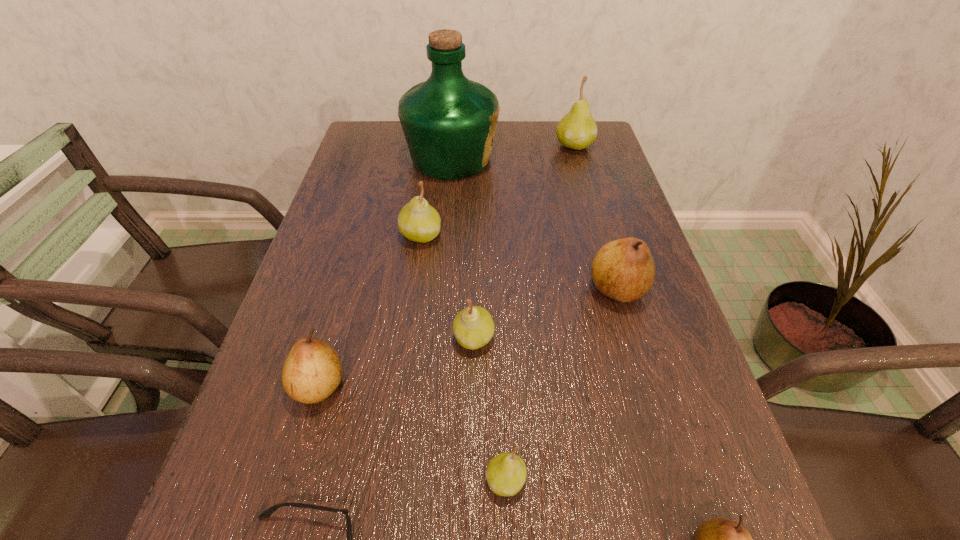
Find the location of a particular element. This screenshot has height=540, width=960. the fourth farthest pear is located at coordinates (473, 327).

Locate an element on the screen. the second smallest green pear is located at coordinates (473, 327).

The height and width of the screenshot is (540, 960). What are the coordinates of `the second nearest pear` in the screenshot? It's located at (506, 473).

The width and height of the screenshot is (960, 540). Find the location of `the third nearest object`. the third nearest object is located at coordinates (506, 473).

The width and height of the screenshot is (960, 540). I want to click on free spot located 0.130m on the label side of the liquor, so click(x=543, y=159).

The width and height of the screenshot is (960, 540). Find the location of `blank space located 0.380m on the front of the rightmost green pear`. blank space located 0.380m on the front of the rightmost green pear is located at coordinates (602, 242).

Where is `free region located 0.350m on the right of the third nearest green pear`? free region located 0.350m on the right of the third nearest green pear is located at coordinates (589, 235).

Locate an element on the screen. This screenshot has width=960, height=540. vacant region located on the front of the biggest brown pear is located at coordinates (665, 456).

The image size is (960, 540). In order to click on vacant space positioned 0.320m on the back of the fifth farthest pear in this screenshot , I will do `click(359, 244)`.

At what (x,y) coordinates should I click in order to perform the action: click on vacant space located 0.120m on the front of the third farthest green pear. Please return your answer as a coordinate pair (x, y). Looking at the image, I should click on (473, 417).